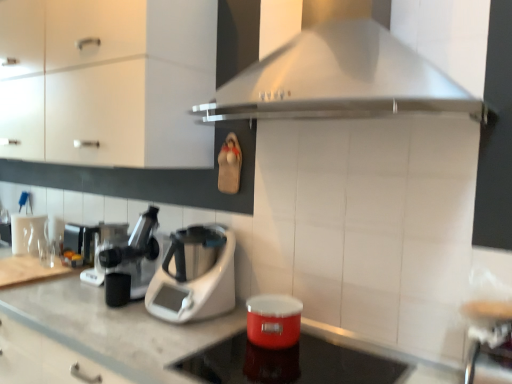
Describe the element at coordinates (132, 262) in the screenshot. I see `white plastic coffee machine at center, placed as the third coffee machine when sorted from left to right` at that location.

Find the location of a particular element. Image resolution: width=512 pixels, height=384 pixels. stainless steel range hood at upper center is located at coordinates (340, 80).

Identify the location of white plastic food processor at center. This screenshot has height=384, width=512. (194, 275).

How distant is shiny red container at center from black plastic coffee machine at left, which is the 2th coffee machine in right-to-left order?

shiny red container at center and black plastic coffee machine at left, which is the 2th coffee machine in right-to-left order, are 38.04 inches apart.

Considering their positions, is shiny red container at center located in front of or behind black plastic coffee machine at left, arranged as the second coffee machine when viewed from the left?

shiny red container at center is positioned closer to the viewer than black plastic coffee machine at left, arranged as the second coffee machine when viewed from the left.

From a real-world perspective, who is located lower, shiny red container at center or black plastic coffee machine at left, which is the 2th coffee machine in right-to-left order?

In real-world perspective, shiny red container at center is lower.

Which is more to the left, shiny red container at center or black plastic coffee machine at left, which is the 2th coffee machine in right-to-left order?

black plastic coffee machine at left, which is the 2th coffee machine in right-to-left order.

Consider the image. From a real-world perspective, is white plastic coffee machine at center, placed as the third coffee machine when sorted from left to right, on matte white cabinet at upper left?

No, from a real-world perspective, white plastic coffee machine at center, placed as the third coffee machine when sorted from left to right, is not on top of matte white cabinet at upper left.

Considering the relative sizes of white plastic coffee machine at center, acting as the 3th coffee machine starting from the back, and matte white cabinet at upper left in the image provided, is white plastic coffee machine at center, acting as the 3th coffee machine starting from the back, bigger than matte white cabinet at upper left?

No.

Is point (144, 275) positioned after point (7, 41)?

No, it is not.

Which is less distant, (336,105) or (95,261)?

Positioned in front is point (336,105).

From a real-world perspective, which is physically below, stainless steel range hood at upper center or black plastic coffee machine at left, which is the 2th coffee machine in right-to-left order?

black plastic coffee machine at left, which is the 2th coffee machine in right-to-left order.

From the image's perspective, which object appears higher, stainless steel range hood at upper center or black plastic coffee machine at left, which is the 2th coffee machine in back-to-front order?

From the image's view, stainless steel range hood at upper center is above.

From the picture: Is stainless steel range hood at upper center turned away from black plastic coffee machine at left, which is the 2th coffee machine in right-to-left order?

stainless steel range hood at upper center is not turned away from black plastic coffee machine at left, which is the 2th coffee machine in right-to-left order.

Is matte white cabinet at upper left outside of metallic silver bar stool at lower right?

matte white cabinet at upper left is positioned outside metallic silver bar stool at lower right.

You are a GUI agent. You are given a task and a screenshot of the screen. Output one action in this format:
    pyautogui.click(x=<x>, y=<y>)
    Task: Click on the bar stool below the matte white cabinet at upper left (from a real-world perspective)
    This screenshot has width=512, height=384.
    Given the screenshot: What is the action you would take?
    pyautogui.click(x=485, y=328)

Based on their sizes in the image, would you say matte white cabinet at upper left is bigger or smaller than metallic silver bar stool at lower right?

Considering their sizes, matte white cabinet at upper left takes up more space than metallic silver bar stool at lower right.

Is point (68, 136) closer or farther from the camera than point (509, 327)?

Clearly, point (68, 136) is more distant from the camera than point (509, 327).

From a real-world perspective, is metallic silver bar stool at lower right under white plastic coffee machine at center, which appears as the first coffee machine when viewed from the right?

Indeed, from a real-world perspective, metallic silver bar stool at lower right is positioned beneath white plastic coffee machine at center, which appears as the first coffee machine when viewed from the right.

Is the position of metallic silver bar stool at lower right less distant than that of white plastic coffee machine at center, which appears as the first coffee machine when viewed from the right?

That is True.

Is metallic silver bar stool at lower right outside of white plastic coffee machine at center, which appears as the first coffee machine when viewed from the right?

Absolutely, metallic silver bar stool at lower right is external to white plastic coffee machine at center, which appears as the first coffee machine when viewed from the right.

From the image's perspective, is metallic silver bar stool at lower right above or below white plastic coffee machine at center, which appears as the first coffee machine when viewed from the right?

metallic silver bar stool at lower right is situated lower than white plastic coffee machine at center, which appears as the first coffee machine when viewed from the right, in the image.

Looking at this image, from a real-world perspective, between metallic silver coffee machine at left, which is the 1th coffee machine from back to front, and stainless steel range hood at upper center, who is vertically lower?

In real-world perspective, metallic silver coffee machine at left, which is the 1th coffee machine from back to front, is lower.

How far apart are metallic silver coffee machine at left, which is the 1th coffee machine from back to front, and stainless steel range hood at upper center?

They are 1.40 meters apart.

How many degrees apart are the facing directions of metallic silver coffee machine at left, which is the 1th coffee machine from back to front, and stainless steel range hood at upper center?

The angular difference between metallic silver coffee machine at left, which is the 1th coffee machine from back to front, and stainless steel range hood at upper center is 0.856 degrees.

Is metallic silver coffee machine at left, which is the 1th coffee machine from back to front, looking in the opposite direction of stainless steel range hood at upper center?

No, metallic silver coffee machine at left, which is the 1th coffee machine from back to front,'s orientation is not away from stainless steel range hood at upper center.

Between white glossy countertop at center and black plastic coffee machine at left, which is the 2th coffee machine in back-to-front order, which one has larger size?

white glossy countertop at center is bigger.

Considering the relative positions of white glossy countertop at center and black plastic coffee machine at left, which is the 2th coffee machine in right-to-left order, in the image provided, is white glossy countertop at center in front of black plastic coffee machine at left, which is the 2th coffee machine in right-to-left order,?

Yes, white glossy countertop at center is closer to the camera.

Is black plastic coffee machine at left, positioned as the second coffee machine in front-to-back order, at the back of white glossy countertop at center?

No, black plastic coffee machine at left, positioned as the second coffee machine in front-to-back order, is not at the back of white glossy countertop at center.

This screenshot has height=384, width=512. Identify the location of appliance in front of the black plastic coffee machine at left, which is the 2th coffee machine in right-to-left order. (289, 363).

I want to click on coffee machine that is the 1st one below the matte white cabinet at upper left (from a real-world perspective), so click(132, 262).

Based on their spatial positions, is white plastic coffee machine at center, acting as the 3th coffee machine starting from the back, or metallic silver bar stool at lower right further from white glossy countertop at center?

metallic silver bar stool at lower right lies further to white glossy countertop at center than the other object.

From the image, which object appears to be nearer to black plastic coffee machine at left, which is the 2th coffee machine in back-to-front order, metallic silver coffee machine at left, which is counted as the third coffee machine, starting from the front, or matte white cabinet at upper left?

Based on the image, metallic silver coffee machine at left, which is counted as the third coffee machine, starting from the front, appears to be nearer to black plastic coffee machine at left, which is the 2th coffee machine in back-to-front order.

Estimate the real-world distances between objects in this image. Which object is further from matte white cabinet at upper left, stainless steel range hood at upper center or white glossy countertop at center?

white glossy countertop at center.

Looking at the image, which one is located further to metallic silver coffee machine at left, which ranks as the 1th coffee machine in left-to-right order, matte white cabinet at upper left or white plastic coffee machine at center, which appears as the first coffee machine when viewed from the right?

Among the two, matte white cabinet at upper left is located further to metallic silver coffee machine at left, which ranks as the 1th coffee machine in left-to-right order.

Estimate the real-world distances between objects in this image. Which object is further from shiny red container at center, metallic silver bar stool at lower right or white glossy countertop at center?

metallic silver bar stool at lower right is further to shiny red container at center.

From the image, which object appears to be nearer to shiny red container at center, white glossy countertop at center or white plastic food processor at center?

Based on the image, white plastic food processor at center appears to be nearer to shiny red container at center.

From the image, which object appears to be nearer to metallic silver coffee machine at left, which is counted as the third coffee machine, starting from the front, white glossy countertop at center or black plastic coffee machine at left, which is the 2th coffee machine in back-to-front order?

black plastic coffee machine at left, which is the 2th coffee machine in back-to-front order.

Which object lies further to the anchor point white plastic coffee machine at center, which appears as the first coffee machine when viewed from the right, metallic silver coffee machine at left, the third coffee machine in the right-to-left sequence, or white glossy countertop at center?

Among the two, metallic silver coffee machine at left, the third coffee machine in the right-to-left sequence, is located further to white plastic coffee machine at center, which appears as the first coffee machine when viewed from the right.

Find the location of a particular element. home appliance located between white glossy countertop at center and metallic silver coffee machine at left, which is the 1th coffee machine from back to front, in the depth direction is located at coordinates (340, 80).

In order to click on kitchen appliance between shiny red container at center and metallic silver coffee machine at left, which ranks as the 1th coffee machine in left-to-right order, along the z-axis in this screenshot , I will do `click(194, 275)`.

What are the coordinates of `home appliance located between white plastic coffee machine at center, which appears as the first coffee machine when viewed from the front, and metallic silver bar stool at lower right in the left-right direction` in the screenshot? It's located at pos(340,80).

Where is `appliance between white glossy countertop at center and black plastic coffee machine at left, which is the 2th coffee machine in right-to-left order, along the z-axis`? The height and width of the screenshot is (384, 512). appliance between white glossy countertop at center and black plastic coffee machine at left, which is the 2th coffee machine in right-to-left order, along the z-axis is located at coordinates pyautogui.click(x=289, y=363).